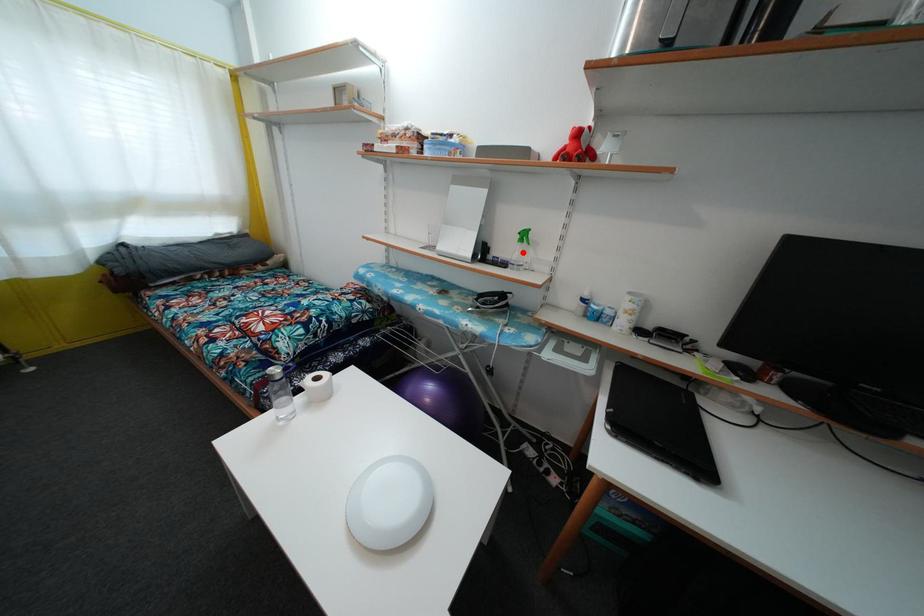
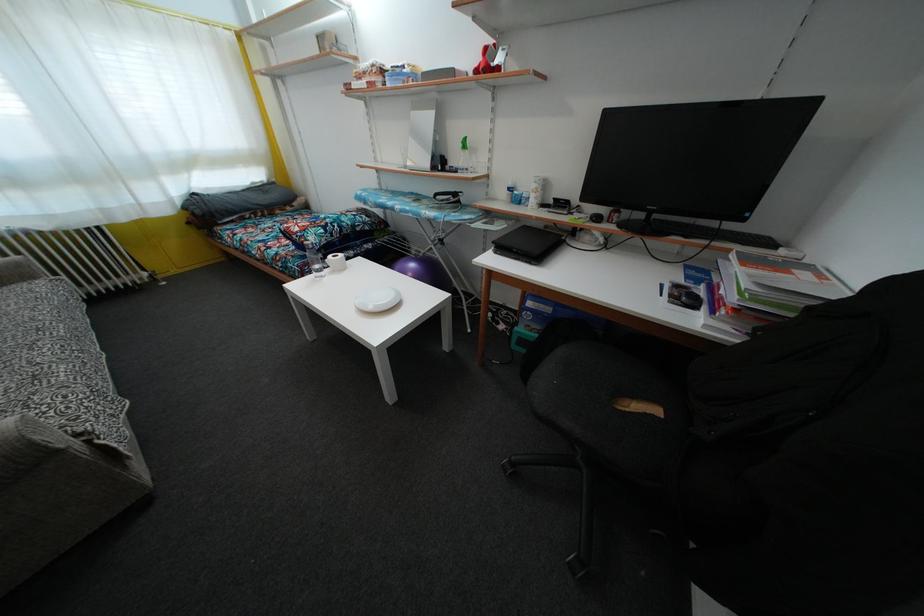
Locate, in the second image, the point that corresponds to the highlighted location in the first image.

(467, 160)